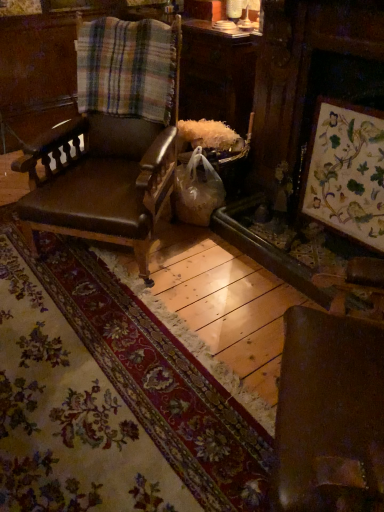
The height and width of the screenshot is (512, 384). What do you see at coordinates (346, 172) in the screenshot? I see `wooden floral artwork at right` at bounding box center [346, 172].

Describe the element at coordinates (128, 68) in the screenshot. This screenshot has height=512, width=384. I see `plaid fabric at upper left` at that location.

Identify the location of wooden floral artwork at right. (346, 172).

I want to click on picture frame behind the brown leather chair at center, so click(x=346, y=172).

Considering the relative positions of brown leather chair at center and wooden floral artwork at right in the image provided, is brown leather chair at center to the right of wooden floral artwork at right from the viewer's perspective?

No.

Considering the positions of objects brown leather chair at center and wooden floral artwork at right in the image provided, who is in front, brown leather chair at center or wooden floral artwork at right?

brown leather chair at center is more forward.

Considering the relative sizes of plaid fabric at upper left and wooden floral artwork at right in the image provided, is plaid fabric at upper left smaller than wooden floral artwork at right?

Correct, plaid fabric at upper left occupies less space than wooden floral artwork at right.

Is plaid fabric at upper left far from wooden floral artwork at right?

That's not correct — plaid fabric at upper left is a little close to wooden floral artwork at right.

Is plaid fabric at upper left at the right side of wooden floral artwork at right?

No, plaid fabric at upper left is not to the right of wooden floral artwork at right.

Can you confirm if plaid fabric at upper left is smaller than brown leather chair at center?

Correct, plaid fabric at upper left occupies less space than brown leather chair at center.

From a real-world perspective, is plaid fabric at upper left positioned above or below brown leather chair at center?

plaid fabric at upper left is situated higher than brown leather chair at center in the real world.

Looking at this image, does plaid fabric at upper left appear on the left side of brown leather chair at center?

No, plaid fabric at upper left is not to the left of brown leather chair at center.

Is brown leather chair at center positioned with its back to plaid fabric at upper left?

That's right, brown leather chair at center is facing away from plaid fabric at upper left.

In the scene shown: How many degrees apart are the facing directions of brown leather chair at center and plaid fabric at upper left?

The angular difference between brown leather chair at center and plaid fabric at upper left is 4.27 degrees.

Is brown leather chair at center far away from plaid fabric at upper left?

No, brown leather chair at center is not far away from plaid fabric at upper left.

Based on their positions, is brown leather chair at center located to the left or right of plaid fabric at upper left?

Based on their positions, brown leather chair at center is located to the left of plaid fabric at upper left.

From their relative heights in the image, would you say wooden floral artwork at right is taller or shorter than plaid fabric at upper left?

wooden floral artwork at right is taller than plaid fabric at upper left.

From a real-world perspective, is wooden floral artwork at right above or below plaid fabric at upper left?

wooden floral artwork at right is below plaid fabric at upper left.

Is wooden floral artwork at right facing towards plaid fabric at upper left?

No, wooden floral artwork at right is not aimed at plaid fabric at upper left.

Is wooden floral artwork at right to the left of plaid fabric at upper left from the viewer's perspective?

In fact, wooden floral artwork at right is to the right of plaid fabric at upper left.

Is wooden floral artwork at right not within brown leather chair at center?

wooden floral artwork at right lies outside brown leather chair at center's area.

Which object is positioned more to the left, wooden floral artwork at right or brown leather chair at center?

brown leather chair at center is more to the left.

Is point (329, 102) closer or farther from the camera than point (141, 141)?

Clearly, point (329, 102) is closer to the camera than point (141, 141).

Which of these two, wooden floral artwork at right or brown leather chair at center, is thinner?

wooden floral artwork at right is thinner.

I want to click on chair lying on the left of wooden floral artwork at right, so click(x=108, y=162).

Where is `picture frame below the plaid fabric at upper left (from a real-world perspective)`? The image size is (384, 512). picture frame below the plaid fabric at upper left (from a real-world perspective) is located at coordinates (346, 172).

Based on their spatial positions, is plaid fabric at upper left or wooden floral artwork at right closer to brown leather chair at center?

The object closer to brown leather chair at center is plaid fabric at upper left.

From the image, which object appears to be nearer to brown leather chair at center, wooden floral artwork at right or plaid fabric at upper left?

plaid fabric at upper left lies closer to brown leather chair at center than the other object.

When comparing their distances from plaid fabric at upper left, does brown leather chair at center or wooden floral artwork at right seem closer?

The object closer to plaid fabric at upper left is brown leather chair at center.

Looking at the image, which one is located closer to plaid fabric at upper left, wooden floral artwork at right or brown leather chair at center?

brown leather chair at center is closer to plaid fabric at upper left.

Considering their positions, is plaid fabric at upper left positioned closer to wooden floral artwork at right than brown leather chair at center?

brown leather chair at center is positioned closer to the anchor wooden floral artwork at right.

Looking at this image, considering their positions, is brown leather chair at center positioned closer to wooden floral artwork at right than plaid fabric at upper left?

brown leather chair at center lies closer to wooden floral artwork at right than the other object.

The height and width of the screenshot is (512, 384). I want to click on plaid located between brown leather chair at center and wooden floral artwork at right in the left-right direction, so click(x=128, y=68).